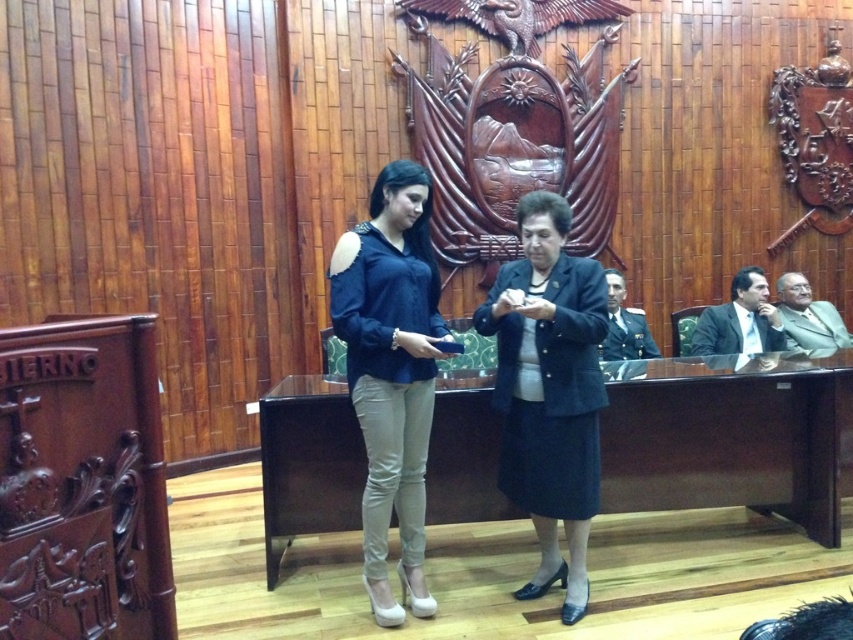
In the scene shown: You are standing in the room and want to hand an object to the woman wearing the dark blue fabric skirt at center. Based on their positions, can you directly approach her without needing to move around any other objects or people?

The dark blue fabric skirt at center is located at point (x=549, y=390), which suggests it is positioned in the central area of the image. Since there are no other objects or people mentioned between you and the woman, you should be able to directly approach her without needing to move around anything else.

You are standing in the room and want to place a small object on the brown wood table at center. Where should you walk to in order to reach it?

The brown wood table at center is located at point (x=730, y=436), so you should walk towards that coordinate to reach it.